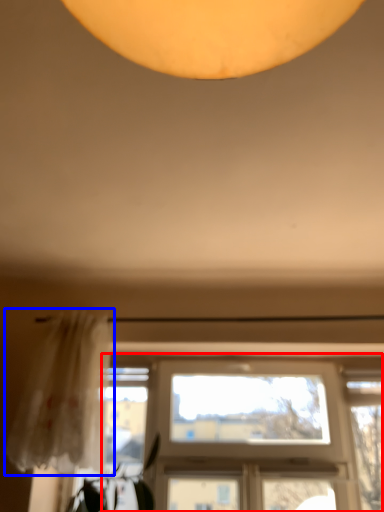
Question: Among these objects, which one is nearest to the camera, window (highlighted by a red box) or curtain (highlighted by a blue box)?

Choices:
 (A) window
 (B) curtain

Answer: (B)